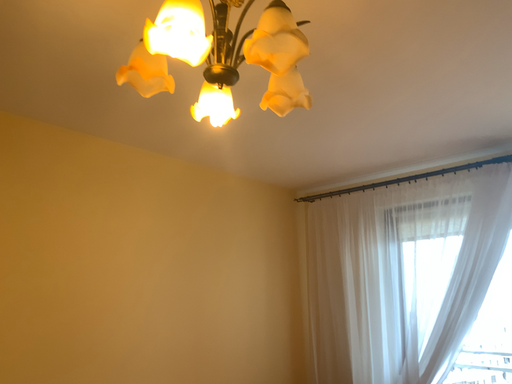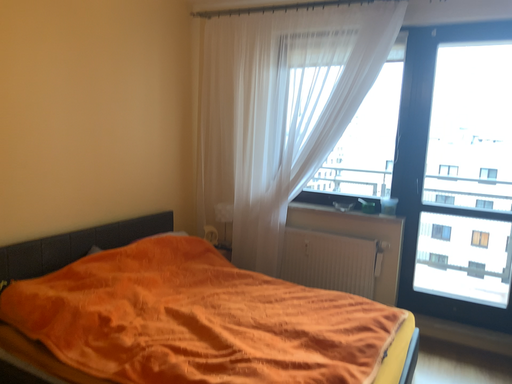
Question: How did the camera likely rotate when shooting the video?

Choices:
 (A) rotated right
 (B) rotated left

Answer: (A)